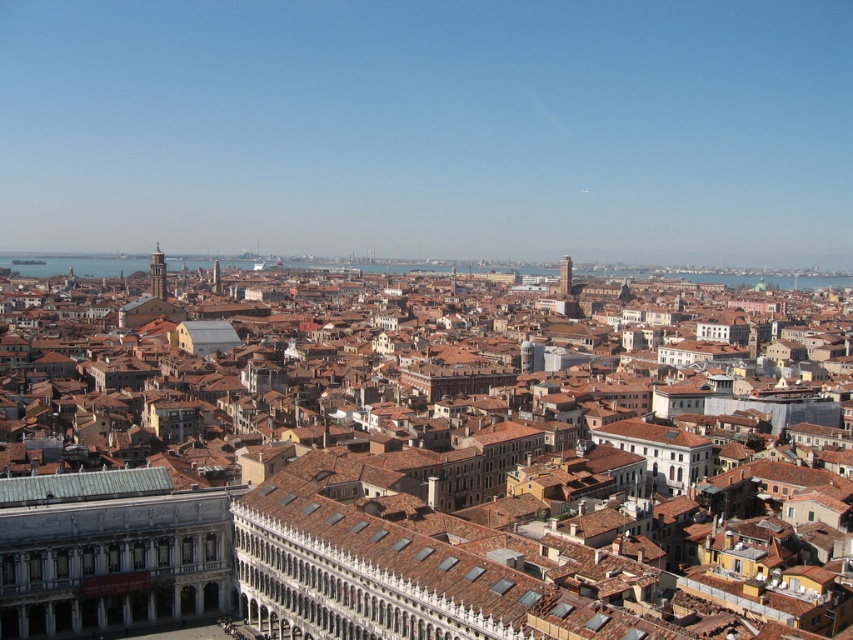
You are an architect visiting Venice and want to compare two towers in the scene. Which tower is bigger in size between the light brown stone tower at center and the smooth stone tower at center?

The light brown stone tower at center is larger in size compared to the smooth stone tower at center.

Looking at this image, you are standing in Venice, Italy, and want to take a photo of the light brown stone tower at center. The camera you have can focus on objects up to 400 meters away. Will the tower be in focus?

The light brown stone tower at center is 385.86 meters away from viewer, so yes, the tower will be in focus since it is within the camera focus range of 400 meters.